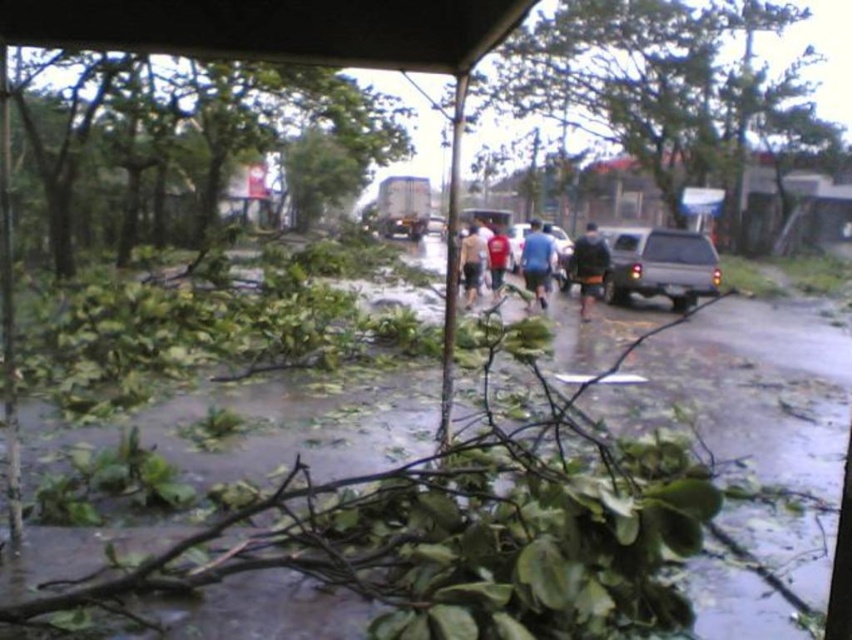
You are a pedestrian trying to cross the road in the image. You see the green leafy tree at upper center and the dark brown fabric pants at center. Which object is larger in size?

The green leafy tree at upper center is bigger than the dark brown fabric pants at center.

You are a delivery person trying to navigate through the disaster area. You see the green leafy debris at center and the green leafy tree at upper center. Which object is closer to the ground?

The green leafy debris at center is below the green leafy tree at upper center, so the debris is closer to the ground.

You are standing at the point with coordinates point (660, 252) and want to walk to the point with coordinates point (804, 440). Given the debris scattered across the road, which direction should you move to reach your destination?

To reach point (804, 440) from point (660, 252), you should move forward since point (804, 440) is in front of point (660, 252).